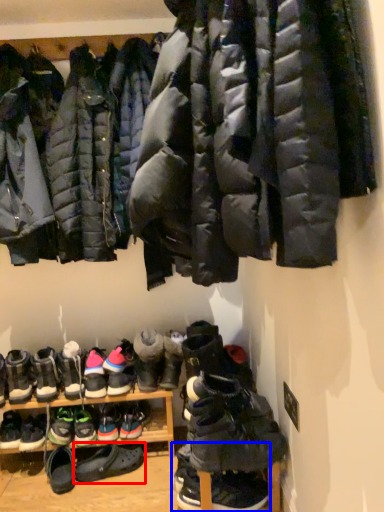
Question: Among these objects, which one is farthest to the camera, footwear (highlighted by a red box) or footwear (highlighted by a blue box)?

Choices:
 (A) footwear
 (B) footwear

Answer: (A)